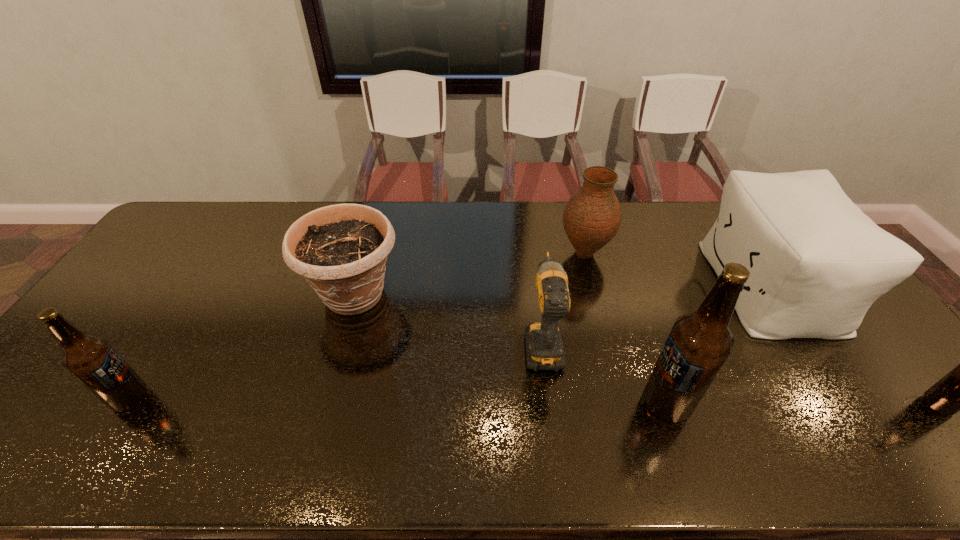
Locate an element on the screen. the second tallest beer bottle is located at coordinates (92, 360).

I want to click on the leftmost beer bottle, so click(x=92, y=360).

In order to click on the second beer bottle from right to left in this screenshot , I will do `click(699, 343)`.

This screenshot has width=960, height=540. What are the coordinates of `the tallest object` in the screenshot? It's located at (699, 343).

You are a GUI agent. You are given a task and a screenshot of the screen. Output one action in this format:
    pyautogui.click(x=<x>, y=<y>)
    Task: Click on the cushion
    This screenshot has width=960, height=540.
    Given the screenshot: What is the action you would take?
    pyautogui.click(x=817, y=263)

You are a GUI agent. You are given a task and a screenshot of the screen. Output one action in this format:
    pyautogui.click(x=<x>, y=<y>)
    Task: Click on the vase
    Image resolution: width=960 pixels, height=540 pixels.
    Given the screenshot: What is the action you would take?
    pyautogui.click(x=592, y=216)

Locate an element on the screen. Image resolution: width=960 pixels, height=540 pixels. the fifth object from right to left is located at coordinates (544, 347).

The height and width of the screenshot is (540, 960). What are the coordinates of `flowerpot` in the screenshot? It's located at (341, 250).

The image size is (960, 540). What are the coordinates of `free region located on the label of the leftmost object` in the screenshot? It's located at (262, 399).

Locate an element on the screen. This screenshot has width=960, height=540. vacant space located on the label of the tallest object is located at coordinates (568, 403).